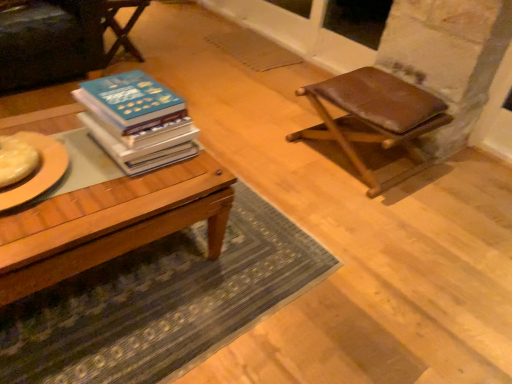
This screenshot has width=512, height=384. What are the coordinates of `vacant region above wooden table at center (from a real-world perspective)` in the screenshot? It's located at (74, 172).